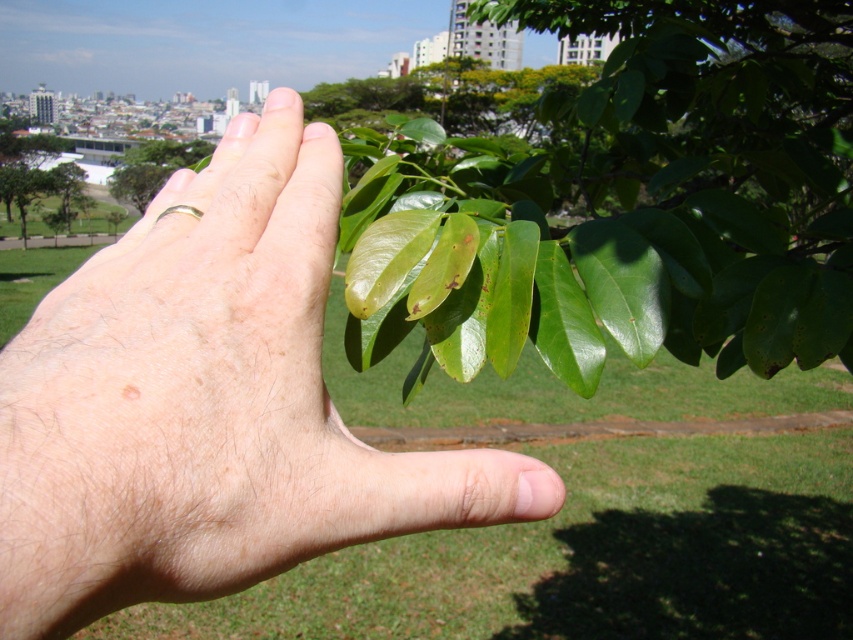
Question: Observing the image, what is the correct spatial positioning of pale skin/hair at center in reference to green glossy leaves at upper center?

Choices:
 (A) right
 (B) left

Answer: (B)

Question: Which object appears closest to the camera in this image?

Choices:
 (A) green glossy leaves at upper center
 (B) green glossy leaf at upper left
 (C) green glossy leaf at upper center

Answer: (A)

Question: Which object appears farthest from the camera in this image?

Choices:
 (A) green glossy leaf at upper left
 (B) green glossy leaf at upper center
 (C) pale skin/hair at center
 (D) green glossy leaves at upper center

Answer: (A)

Question: Does pale skin/hair at center have a larger size compared to green glossy leaves at upper center?

Choices:
 (A) no
 (B) yes

Answer: (A)

Question: Is green glossy leaf at upper left wider than green glossy leaf at upper center?

Choices:
 (A) yes
 (B) no

Answer: (A)

Question: Which point is farther from the camera taking this photo?

Choices:
 (A) (144, 186)
 (B) (7, 141)

Answer: (B)